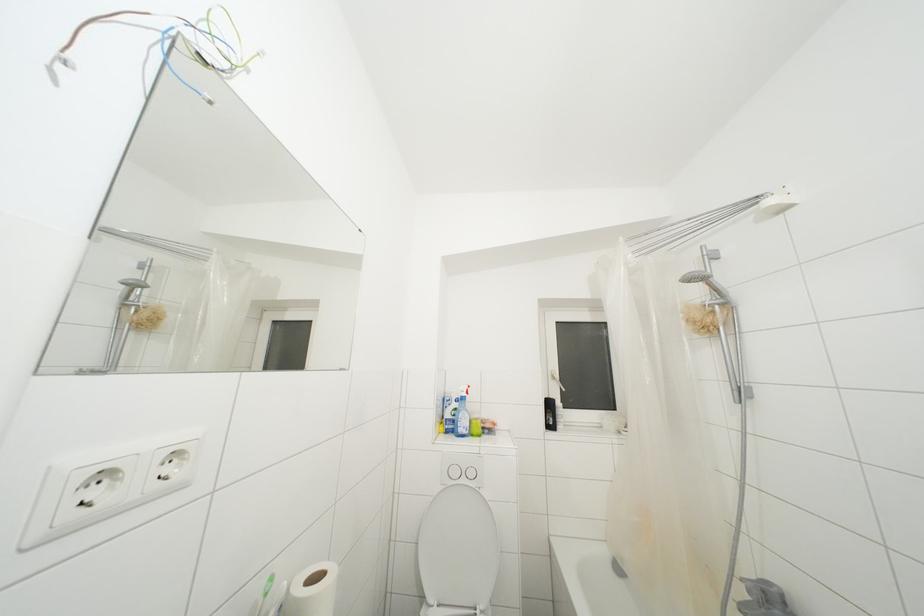
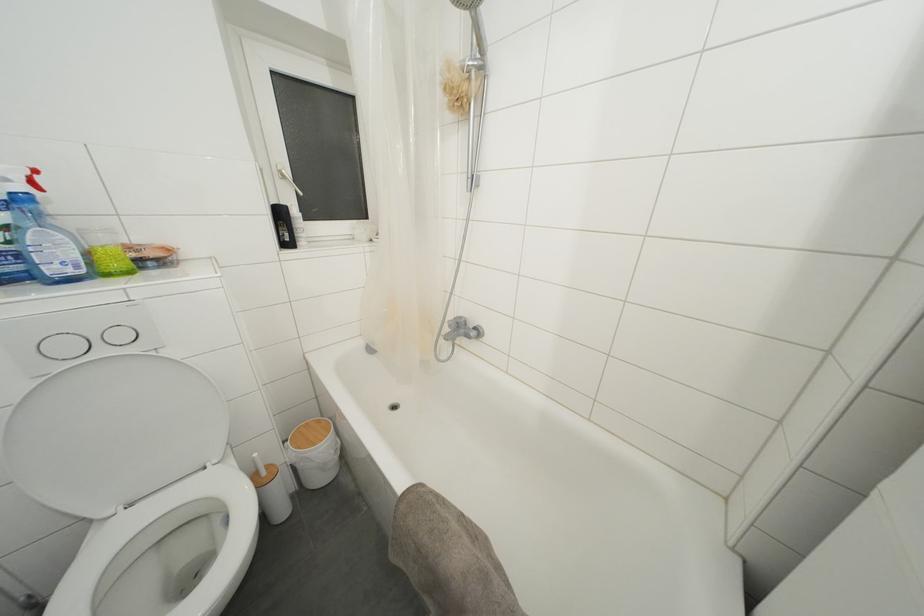
In the second image, find the point that corresponds to point (468, 485) in the first image.

(106, 357)